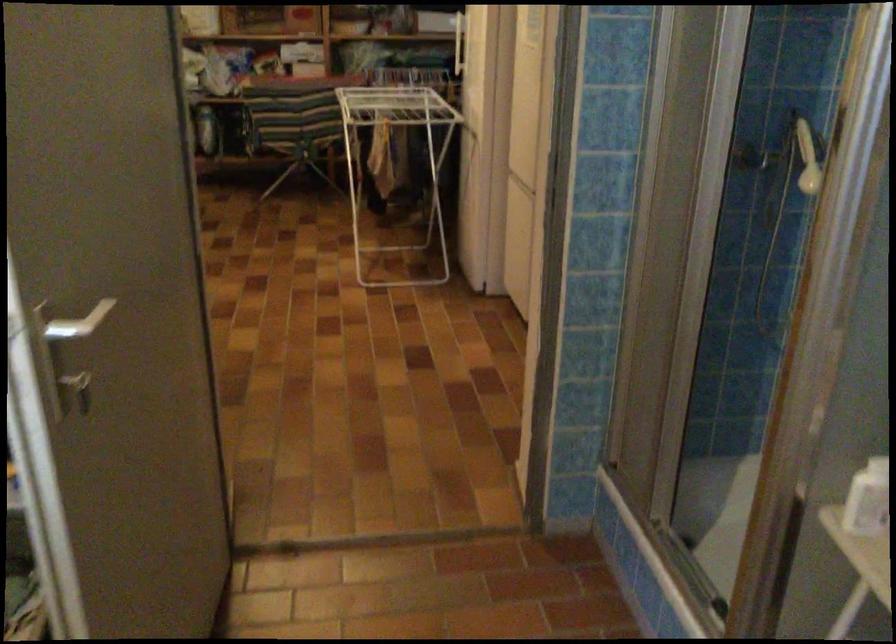
You are a GUI agent. You are given a task and a screenshot of the screen. Output one action in this format:
    pyautogui.click(x=<x>, y=<y>)
    Task: Click on the white shower head
    The width and height of the screenshot is (896, 644).
    Given the screenshot: What is the action you would take?
    pyautogui.click(x=807, y=158)